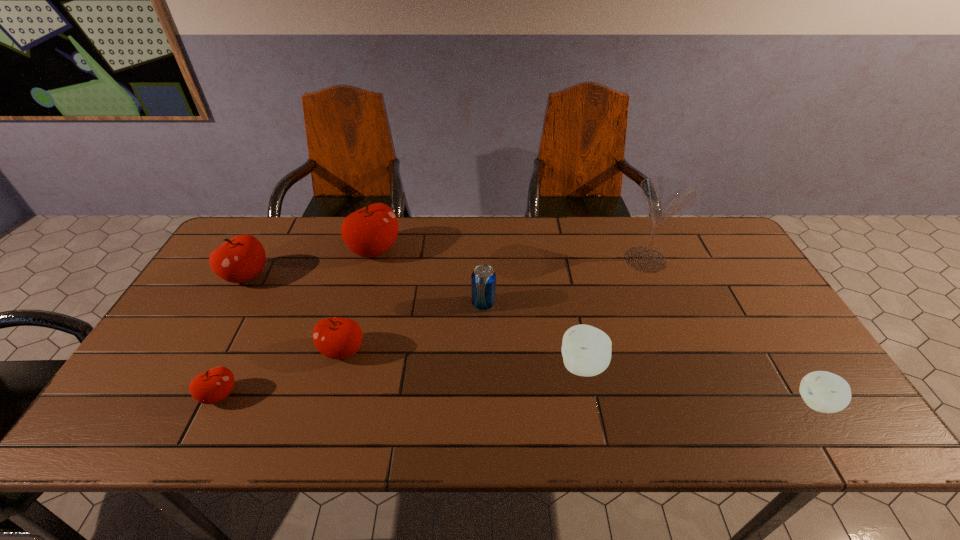
In order to click on free space between the tallest apple and the second object from right to left in this screenshot , I will do `click(510, 255)`.

In order to click on empty space between the blue beer can and the flute glass in this screenshot , I will do `click(564, 282)`.

Find the location of a particular element. blank region between the nearer white apple and the second biggest red apple is located at coordinates (532, 340).

The width and height of the screenshot is (960, 540). I want to click on the sixth closest object to the left white apple, so click(212, 386).

Select which object appears as the sixth closest to the rightmost apple. Please provide its 2D coordinates. Your answer should be formatted as a tuple, i.e. [(x, y)], where the tuple contains the x and y coordinates of a point satisfying the conditions above.

[(212, 386)]

The height and width of the screenshot is (540, 960). I want to click on the closest apple to the sixth shortest object, so click(x=371, y=231).

Locate an element on the screen. apple identified as the third closest to the nearer white apple is located at coordinates [x=371, y=231].

This screenshot has width=960, height=540. Identify the location of red apple that is the third closest to the tallest apple. (212, 386).

Locate an element on the screen. red apple that is the third closest to the fifth nearest object is located at coordinates point(212,386).

Image resolution: width=960 pixels, height=540 pixels. Find the location of `vacant area that satisfies the following two spatial constraints: 1. on the front side of the fifth apple from left to right; 2. on the left side of the rightmost object`. vacant area that satisfies the following two spatial constraints: 1. on the front side of the fifth apple from left to right; 2. on the left side of the rightmost object is located at coordinates (590, 403).